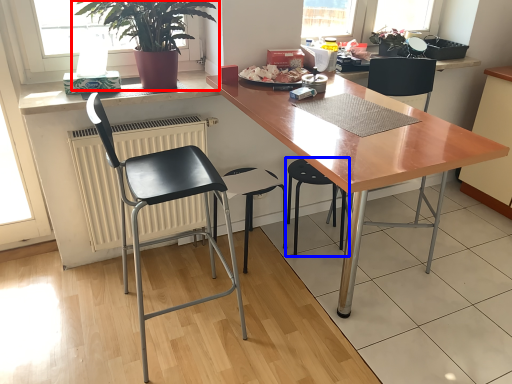
Question: Which object is closer to the camera taking this photo, houseplant (highlighted by a red box) or chair (highlighted by a blue box)?

Choices:
 (A) houseplant
 (B) chair

Answer: (A)